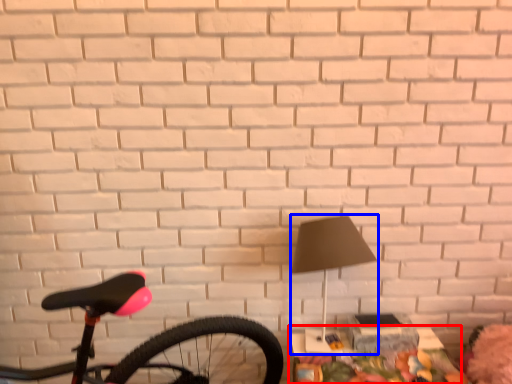
Question: Which point is closer to the camera, table (highlighted by a red box) or lamp (highlighted by a blue box)?

Choices:
 (A) table
 (B) lamp

Answer: (B)